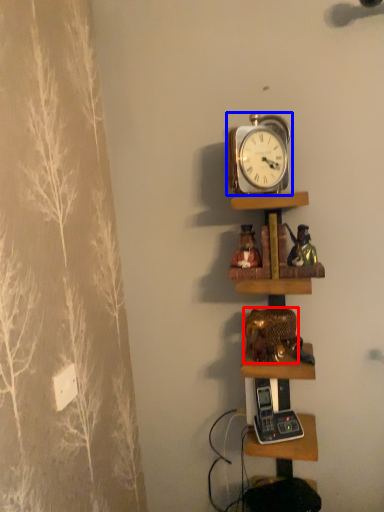
Question: Among these objects, which one is farthest to the camera, toy (highlighted by a red box) or alarm clock (highlighted by a blue box)?

Choices:
 (A) toy
 (B) alarm clock

Answer: (A)